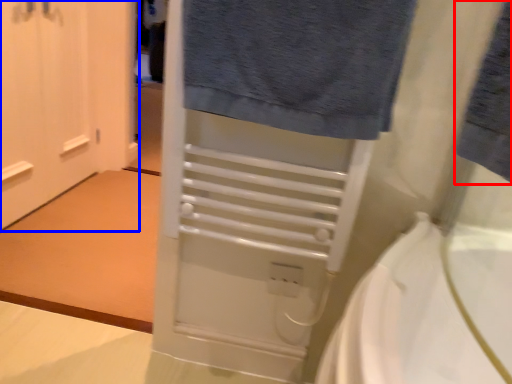
Question: Which point is further to the camera, bath towel (highlighted by a red box) or door (highlighted by a blue box)?

Choices:
 (A) bath towel
 (B) door

Answer: (B)